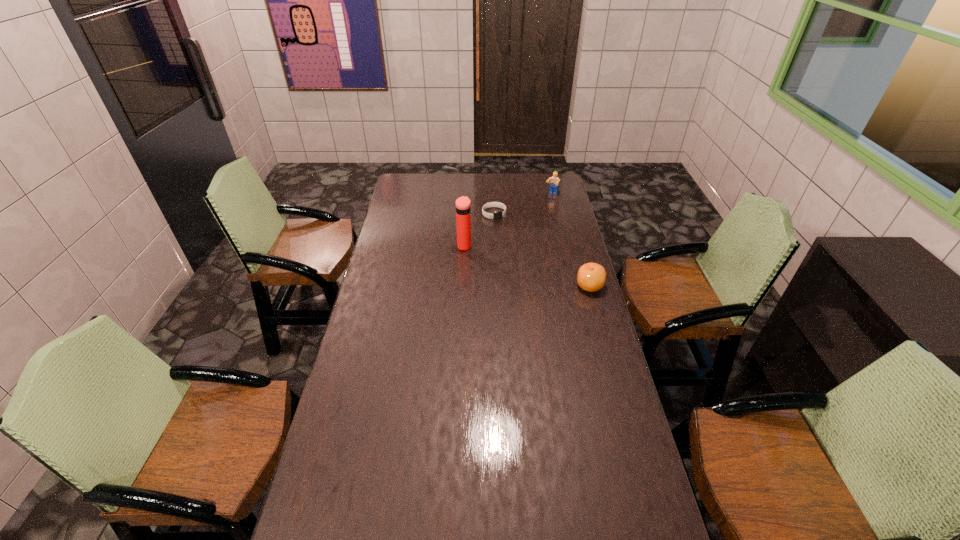
At what (x,y) coordinates should I click in order to perform the action: click on free space located 0.190m on the outer surface of the shortest object. Please return your answer as a coordinate pair (x, y). Looking at the image, I should click on (514, 242).

What are the coordinates of `vacant space located 0.200m on the outer surface of the shortest object` in the screenshot? It's located at (515, 244).

Where is `blank space located on the outer surface of the shortest object`? The width and height of the screenshot is (960, 540). blank space located on the outer surface of the shortest object is located at coordinates (533, 269).

The width and height of the screenshot is (960, 540). What are the coordinates of `vacant space located 0.320m on the face of the Lego` in the screenshot? It's located at (528, 230).

The width and height of the screenshot is (960, 540). Identify the location of free space located on the face of the Lego. (533, 222).

Find the location of `vacant space situated on the face of the Lego`. vacant space situated on the face of the Lego is located at coordinates (522, 238).

The image size is (960, 540). I want to click on object present at the far edge, so click(x=554, y=182).

At what (x,y) coordinates should I click in order to perform the action: click on clementine positioned at the right edge. Please return your answer as a coordinate pair (x, y). Looking at the image, I should click on (591, 277).

Where is `Lego at the right edge`? Lego at the right edge is located at coordinates (554, 182).

The image size is (960, 540). I want to click on object present at the far right corner, so click(554, 182).